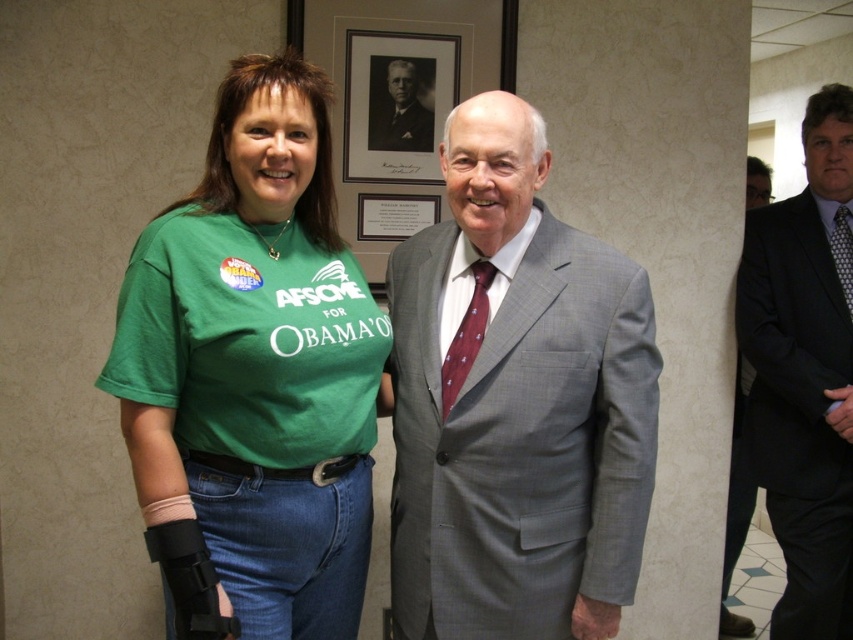
Question: Among these points, which one is farthest from the camera?

Choices:
 (A) (737, 628)
 (B) (250, 563)

Answer: (A)

Question: Is dark gray suit at right bigger than black suit at right?

Choices:
 (A) no
 (B) yes

Answer: (A)

Question: Among these objects, which one is nearest to the camera?

Choices:
 (A) black suit at right
 (B) dark gray suit at right
 (C) maroon silk tie at center

Answer: (C)

Question: Where is black suit at right located in relation to maroon textured tie at center in the image?

Choices:
 (A) below
 (B) above

Answer: (A)

Question: Considering the real-world distances, which object is farthest from the green t-shirt at center?

Choices:
 (A) dark gray suit at right
 (B) black and white photograph of man at upper center
 (C) maroon textured tie at center
 (D) matte green t-shirt at center

Answer: (C)

Question: Does black suit at right come in front of matte green t-shirt at center?

Choices:
 (A) no
 (B) yes

Answer: (A)